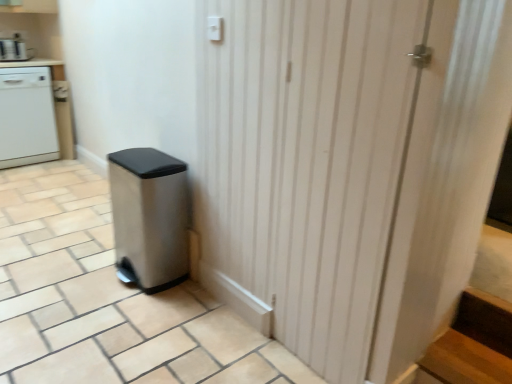
This screenshot has height=384, width=512. Identify the location of vacant region to the left of stainless steel trash can at lower left. [78, 275].